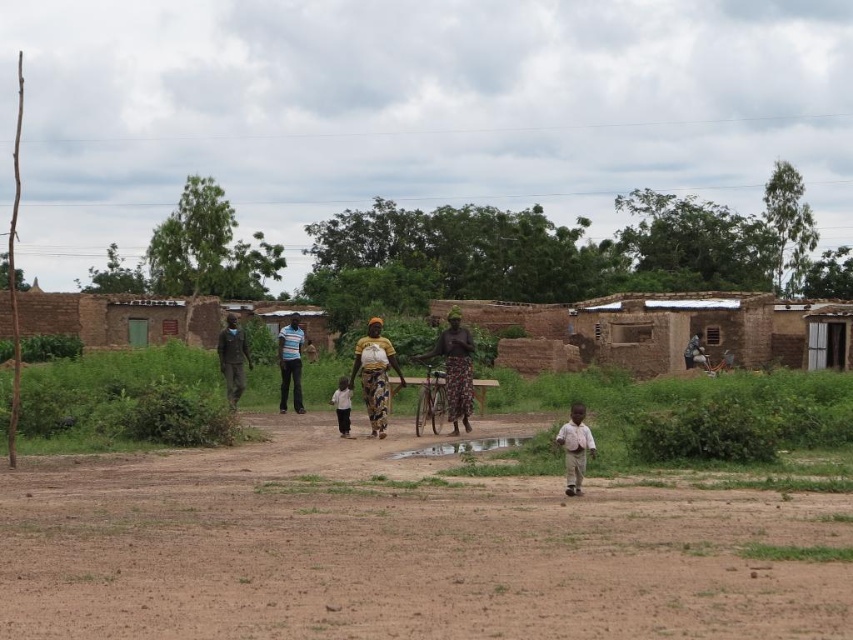
You are standing at the center of the dirt path in the rural village scene. You see a white cotton shirt at center and a dark brown wooden chair at right. How far apart are these two objects from each other?

The white cotton shirt at center is 38.55 meters away from the dark brown wooden chair at right.

You are standing at the entrance of the village and see the point marked at coordinates [456,369]. What is located at that point?

The point at [456,369] marks the location of the patterned fabric dress at center.

You are standing on the dirt path in the village scene and notice two people wearing the patterned fabric dress at center and the striped cotton shirt at center. Which person is shorter?

The patterned fabric dress at center is worn by a shorter person compared to the striped cotton shirt at center.